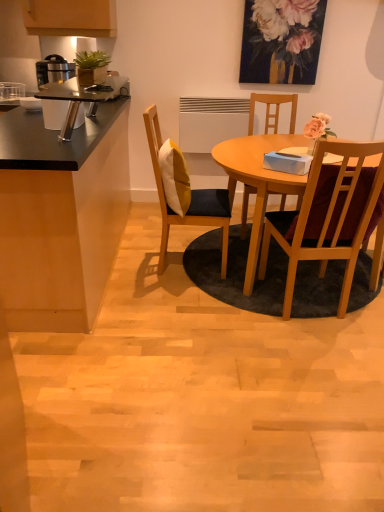
Question: Is wooden chair at center, which is the second chair in left-to-right order, taller or shorter than floral painting at upper center?

Choices:
 (A) tall
 (B) short

Answer: (A)

Question: Is wooden chair at center, arranged as the 2th chair when viewed from the right, situated inside floral painting at upper center or outside?

Choices:
 (A) outside
 (B) inside

Answer: (A)

Question: Which object is positioned closest to the floral painting at upper center?

Choices:
 (A) black matte cabinet at left
 (B) wooden chair at center right, the 3th chair from the left
 (C) wooden chair at center, arranged as the 2th chair when viewed from the right
 (D) wooden chair with cushion at center, which ranks as the 1th chair in left-to-right order

Answer: (C)

Question: Which object is positioned closest to the wooden chair at center right, the 3th chair from the left?

Choices:
 (A) wooden chair with cushion at center, which ranks as the 1th chair in left-to-right order
 (B) wooden chair at center, arranged as the 2th chair when viewed from the right
 (C) floral painting at upper center
 (D) black matte cabinet at left

Answer: (A)